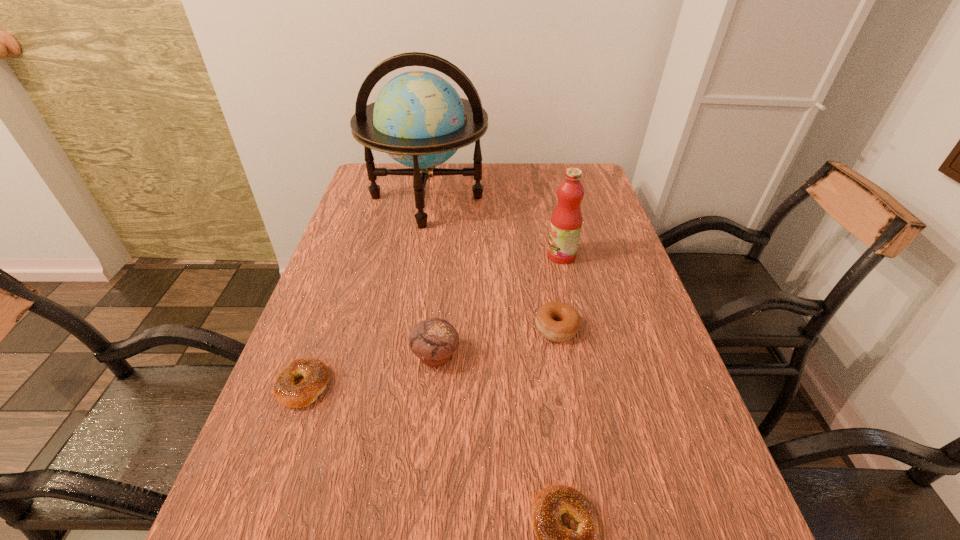
This screenshot has width=960, height=540. I want to click on vacant space situated 0.110m on the front label of the fruit juice, so click(x=507, y=255).

The image size is (960, 540). I want to click on free location located 0.090m on the front label of the fruit juice, so click(x=515, y=255).

Find the location of a particular element. vacant space located on the front of the third tallest object is located at coordinates (418, 536).

This screenshot has width=960, height=540. In order to click on free location located 0.190m on the back of the tallest bagel in this screenshot , I will do `click(544, 262)`.

This screenshot has height=540, width=960. Find the location of `free location located on the right of the leftmost bagel`. free location located on the right of the leftmost bagel is located at coordinates (462, 384).

This screenshot has width=960, height=540. What are the coordinates of `object that is at the far edge` in the screenshot? It's located at (418, 119).

Where is `globe that is at the left edge`? This screenshot has width=960, height=540. globe that is at the left edge is located at coordinates [418, 119].

Identify the location of bagel located at the left edge. (316, 375).

In order to click on object present at the right edge in this screenshot , I will do `click(566, 221)`.

This screenshot has width=960, height=540. In order to click on object present at the far left corner in this screenshot , I will do `click(418, 119)`.